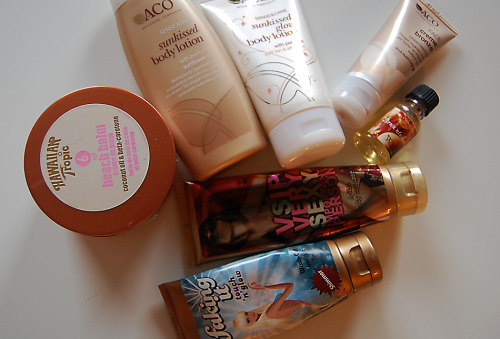
The width and height of the screenshot is (500, 339). I want to click on jar lid, so click(134, 207).